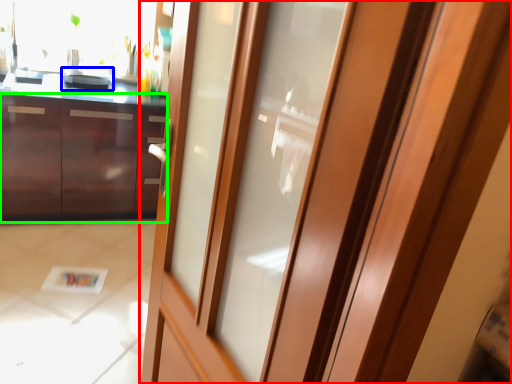
Question: Which object is the farthest from door (highlighted by a red box)? Choose among these: appliance (highlighted by a blue box) or cabinetry (highlighted by a green box).

Choices:
 (A) appliance
 (B) cabinetry

Answer: (A)